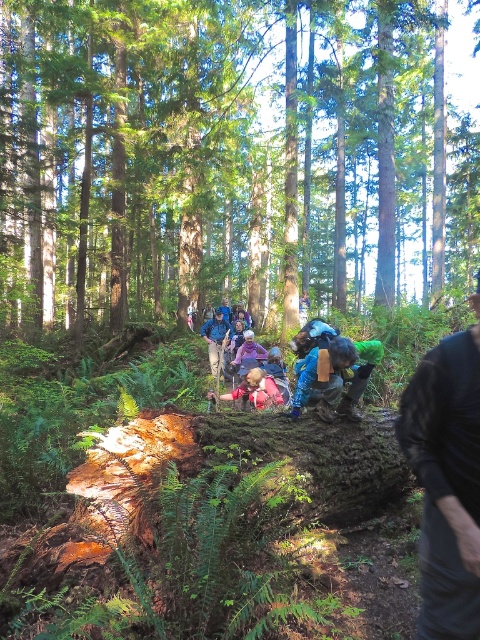
You are a hiker standing at the camera position. You need to reach a hidden treasure located at point (372, 208). If your GPS says the treasure is 120 feet away, is the GPS reading accurate?

The distance between point (372, 208) and the camera is 120.19 feet, so the GPS reading of 120 feet is accurate within a 0.19 feet margin of error.

You are a hiker who just arrived at the forest trail. You see a blue fabric backpack at center and a pink fabric at center. Which one is bigger?

The blue fabric backpack at center is larger in size than the pink fabric at center.